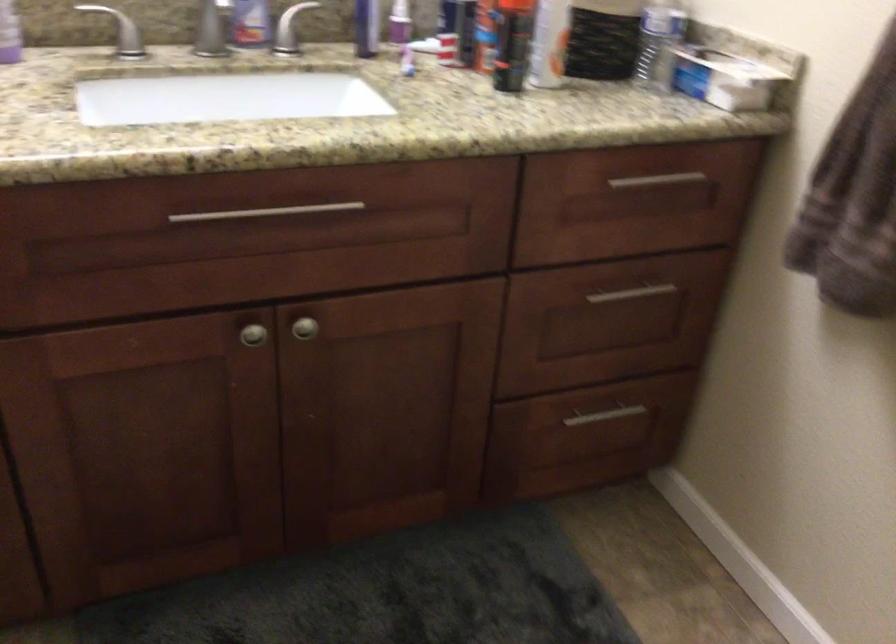
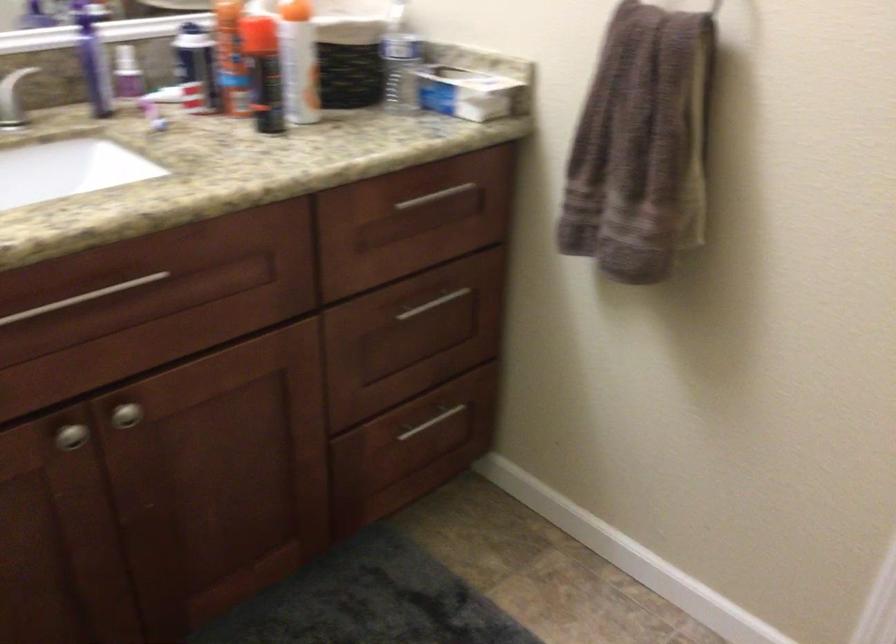
Question: I am providing you with two images of the same scene from different viewpoints. After the viewpoint changes to image2, which objects are now occluded?

Choices:
 (A) faucet handle
 (B) brown towel
 (C) black spray can
 (D) none of these

Answer: (D)